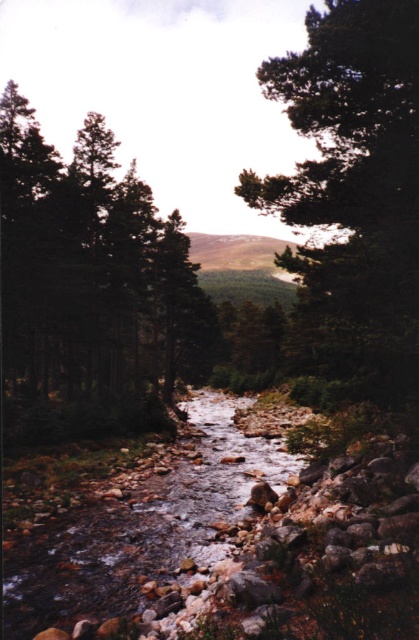
Which is above, green matte tree at left or green matte tree at center?

Positioned higher is green matte tree at left.

Is point (56, 289) closer to viewer compared to point (325, 216)?

No, (56, 289) is further to viewer.

Is point (0, 104) positioned behind point (375, 170)?

Yes, point (0, 104) is farther from viewer.

At what (x,y) coordinates should I click in order to perform the action: click on green matte tree at left. Please return your answer as a coordinate pair (x, y). Looking at the image, I should click on [90, 285].

Between green matte tree at left and clear water at stream center, which one appears on the left side from the viewer's perspective?

green matte tree at left

From the picture: Does green matte tree at left have a greater width compared to clear water at stream center?

Yes, green matte tree at left is wider than clear water at stream center.

Identify the location of green matte tree at left. (90, 285).

Find the location of a particular element. This screenshot has width=419, height=640. green matte tree at left is located at coordinates (90, 285).

Which is above, green matte tree at center or clear water at stream center?

green matte tree at center

Looking at this image, can you confirm if green matte tree at center is positioned above clear water at stream center?

Correct, green matte tree at center is located above clear water at stream center.

This screenshot has height=640, width=419. In order to click on green matte tree at center in this screenshot , I will do click(354, 182).